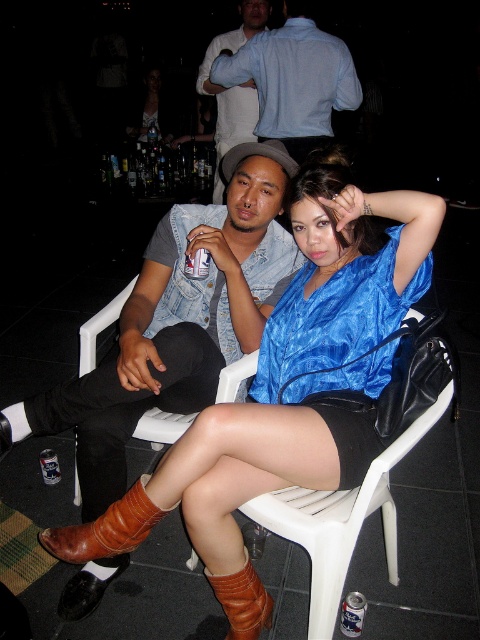
Measure the distance between point (126, 131) and camera.

A distance of 5.75 meters exists between point (126, 131) and camera.

Does matte black dress at center lie behind clear plastic bottle at upper center?

Yes, matte black dress at center is further from the viewer.

You are a GUI agent. You are given a task and a screenshot of the screen. Output one action in this format:
    pyautogui.click(x=<x>, y=<y>)
    Task: Click on the matte black dress at center
    The height and width of the screenshot is (640, 480).
    Given the screenshot: What is the action you would take?
    pyautogui.click(x=151, y=109)

Who is more distant from viewer, [215,45] or [176,156]?

The point [176,156] is behind.

Between denim jacket at upper center and clear glass bottles at upper center, which one is positioned higher?

denim jacket at upper center is above.

Is point (254, 99) positioned in front of point (146, 166)?

Yes, point (254, 99) is closer to viewer.

Locate an element on the screen. Image resolution: width=480 pixels, height=640 pixels. denim jacket at upper center is located at coordinates (232, 86).

Can you confirm if velvet blue blouse at center is positioned above brown leather boot at lower center?

Yes.

Locate an element on the screen. velvet blue blouse at center is located at coordinates (289, 380).

Where is `velvet blue blouse at center`? The image size is (480, 640). velvet blue blouse at center is located at coordinates (289, 380).